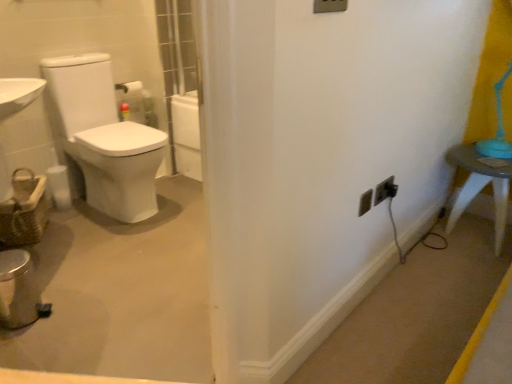
Question: Is woven brown basket at left not near white plastic light switch at upper center?

Choices:
 (A) yes
 (B) no

Answer: (A)

Question: From the image's perspective, is woven brown basket at left beneath white plastic light switch at upper center?

Choices:
 (A) yes
 (B) no

Answer: (A)

Question: Can you confirm if woven brown basket at left is smaller than white plastic light switch at upper center?

Choices:
 (A) no
 (B) yes

Answer: (A)

Question: Can you confirm if woven brown basket at left is taller than white plastic light switch at upper center?

Choices:
 (A) yes
 (B) no

Answer: (A)

Question: Is woven brown basket at left to the right of white plastic light switch at upper center from the viewer's perspective?

Choices:
 (A) yes
 (B) no

Answer: (B)

Question: Does woven brown basket at left have a lesser width compared to white plastic light switch at upper center?

Choices:
 (A) yes
 (B) no

Answer: (B)

Question: Does white plastic outlet at lower right, the first electric outlet when ordered from left to right, have a greater height compared to white plastic light switch at upper center?

Choices:
 (A) yes
 (B) no

Answer: (B)

Question: Is white plastic outlet at lower right, the first electric outlet when ordered from left to right, wider than white plastic light switch at upper center?

Choices:
 (A) yes
 (B) no

Answer: (A)

Question: Is white plastic light switch at upper center surrounded by white plastic outlet at lower right, which appears as the third electric outlet when viewed from the right?

Choices:
 (A) yes
 (B) no

Answer: (B)

Question: From a real-world perspective, is white plastic outlet at lower right, the first electric outlet when ordered from left to right, on white plastic light switch at upper center?

Choices:
 (A) no
 (B) yes

Answer: (A)

Question: Is white plastic outlet at lower right, the first electric outlet when ordered from left to right, not near white plastic light switch at upper center?

Choices:
 (A) no
 (B) yes

Answer: (A)

Question: From the image's perspective, is white plastic outlet at lower right, the first electric outlet when ordered from left to right, located beneath white plastic light switch at upper center?

Choices:
 (A) no
 (B) yes

Answer: (B)

Question: Is woven brown basket at left taller than white plastic table at right?

Choices:
 (A) no
 (B) yes

Answer: (A)